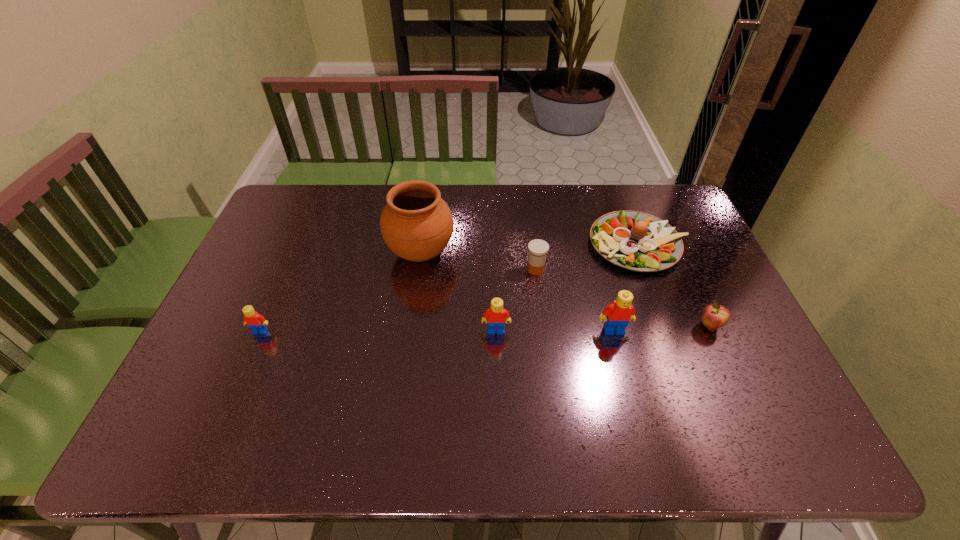
Please point a space for a new Lego to maintain equal intervals. Please provide its 2D coordinates. Your answer should be formatted as a tuple, i.e. [(x, y)], where the tuple contains the x and y coordinates of a point satisfying the conditions above.

[(378, 331)]